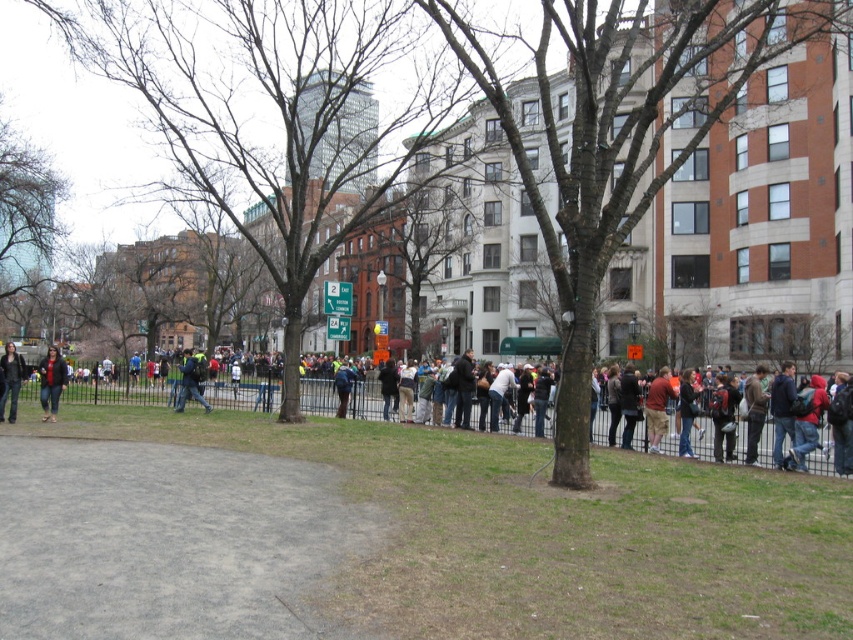
You are a photographer standing in the crowd at the event. You want to take a picture of the smooth bark tree at center without any people in the frame. Since the dark blue jeans at center are blocking your view, can you adjust your position to capture the tree?

The smooth bark tree at center is located above dark blue jeans at center, so you can lower your camera angle or move to a position where the dark blue jeans at center are below your line of sight to capture the tree without obstruction.

You are a photographer standing at the center of the scene. You want to take a photo of the dark blue jacket at right. To do this, you need to move in a straight line towards it. Is there any object in your path that might block your view? Please answer based on the coordinates provided.

The dark blue jacket at right is located at coordinates point (782, 410). Since there are no other objects mentioned in the path between your current position and the jacket, you can move straight towards it without obstruction.

You are standing in the crowd at the event and notice the smooth bark tree at center and the dark blue jeans at center. From your perspective, which object is located to the right?

The smooth bark tree at center is positioned on the right side of dark blue jeans at center, so the smooth bark tree at center is to the right.